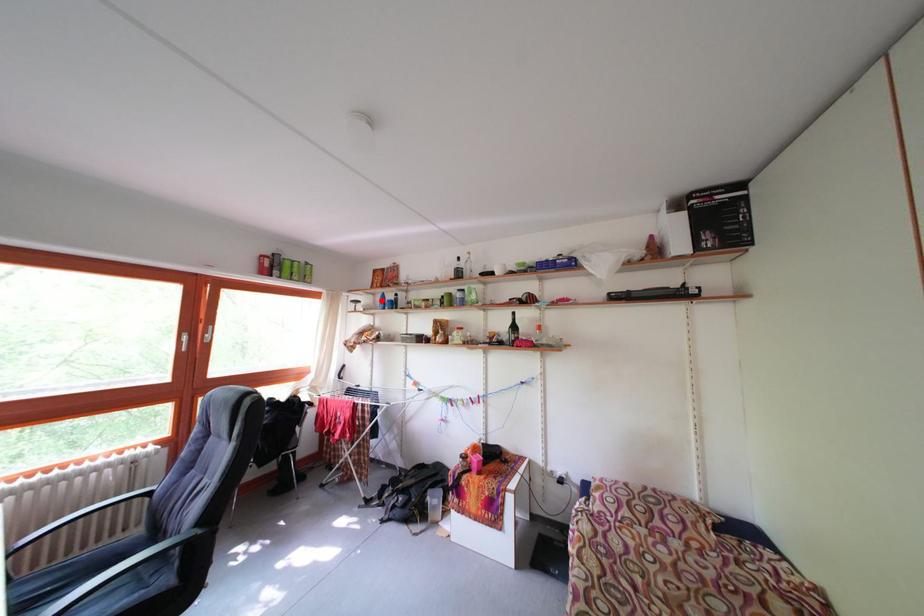
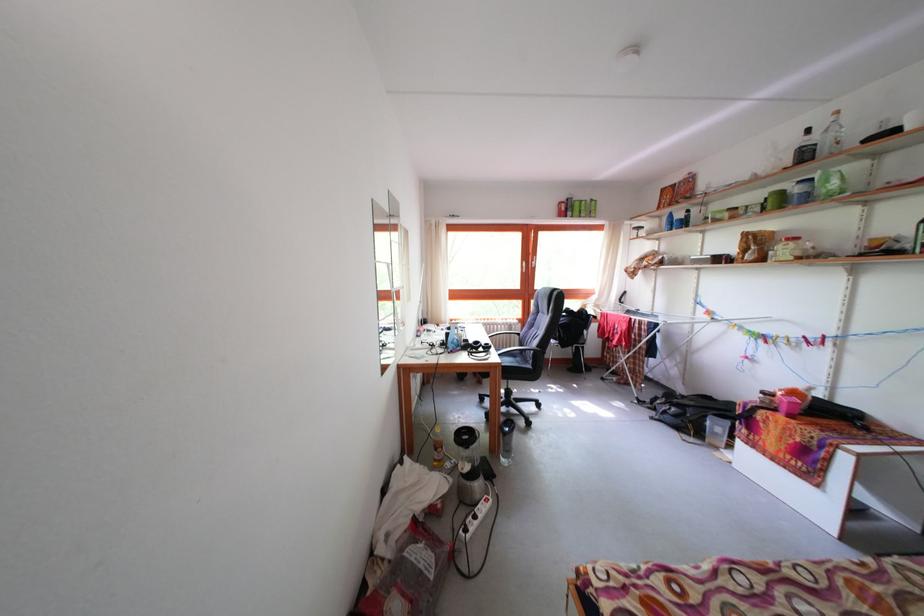
Question: I am providing you with two images of the same scene from different viewpoints. A red point is marked on the first image. At the location where the point appears in image 1, is it still visible in image 2?

Choices:
 (A) Yes
 (B) No

Answer: (A)